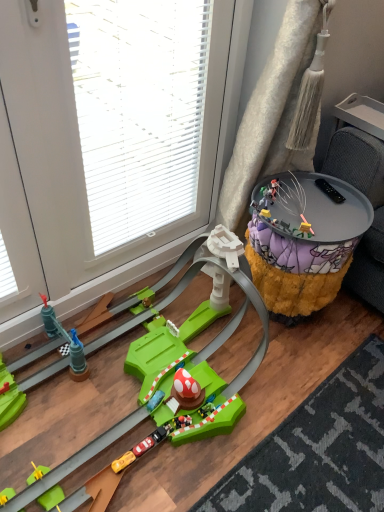
Locate an element on the screen. free location to the right of metallic gold figure at center-right, the 2th toy when ordered from left to right is located at coordinates (347, 219).